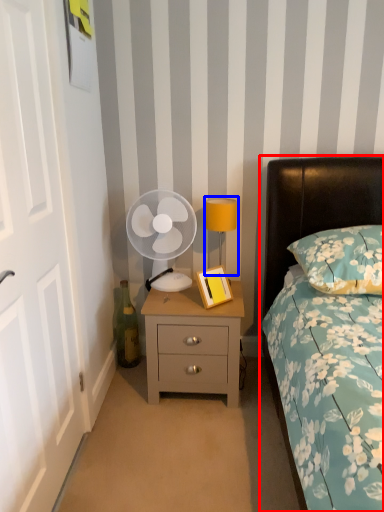
Question: Which of the following is the closest to the observer, bed (highlighted by a red box) or bedside lamp (highlighted by a blue box)?

Choices:
 (A) bed
 (B) bedside lamp

Answer: (A)